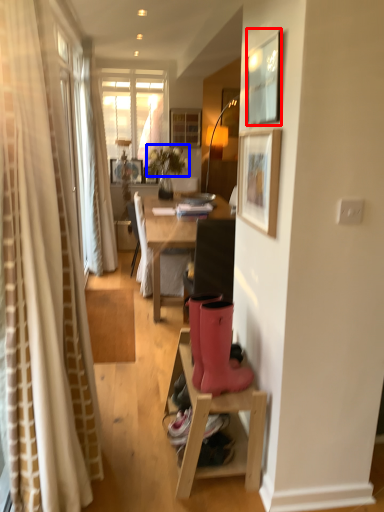
Question: Which object appears closest to the camera in this image, picture frame (highlighted by a red box) or flower (highlighted by a blue box)?

Choices:
 (A) picture frame
 (B) flower

Answer: (A)